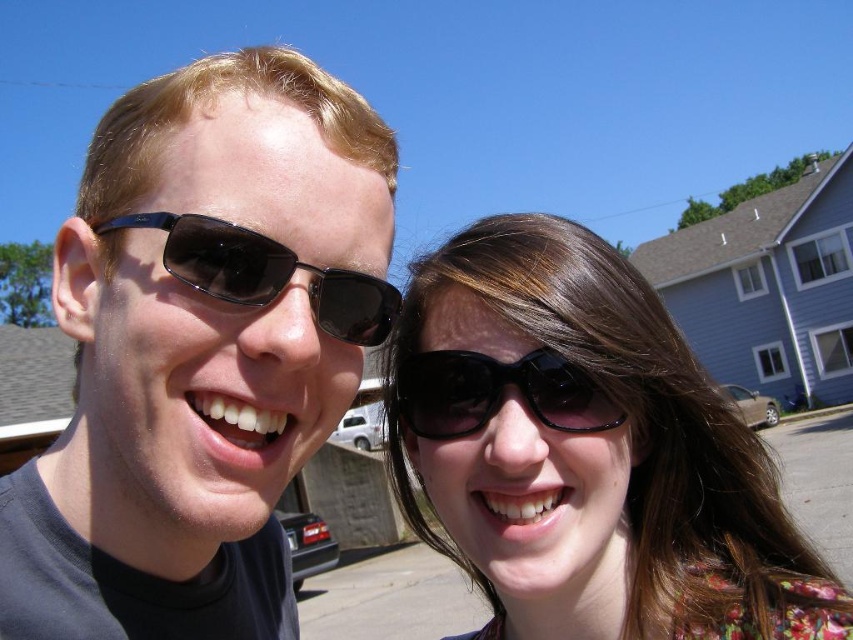
Which of these two, matte black sunglasses at center or black shiny sunglasses at center, stands taller?

matte black sunglasses at center is taller.

Is matte black sunglasses at center closer to the viewer compared to black shiny sunglasses at center?

Yes, it is in front of black shiny sunglasses at center.

Describe the element at coordinates (585, 452) in the screenshot. I see `matte black sunglasses at center` at that location.

Identify the location of matte black sunglasses at center. (585, 452).

Who is positioned more to the right, matte black sunglasses at left or matte black sunglasses at center?

matte black sunglasses at center is more to the right.

Does matte black sunglasses at left have a greater width compared to matte black sunglasses at center?

In fact, matte black sunglasses at left might be narrower than matte black sunglasses at center.

Is point (218, 522) more distant than point (408, 499)?

No, (218, 522) is in front of (408, 499).

In order to click on matte black sunglasses at left in this screenshot , I will do `click(200, 349)`.

Where is `black plastic sunglasses at left`? black plastic sunglasses at left is located at coordinates (265, 273).

Is black plastic sunglasses at left to the right of black shiny sunglasses at center from the viewer's perspective?

No, black plastic sunglasses at left is not to the right of black shiny sunglasses at center.

Where is `black plastic sunglasses at left`? This screenshot has width=853, height=640. black plastic sunglasses at left is located at coordinates point(265,273).